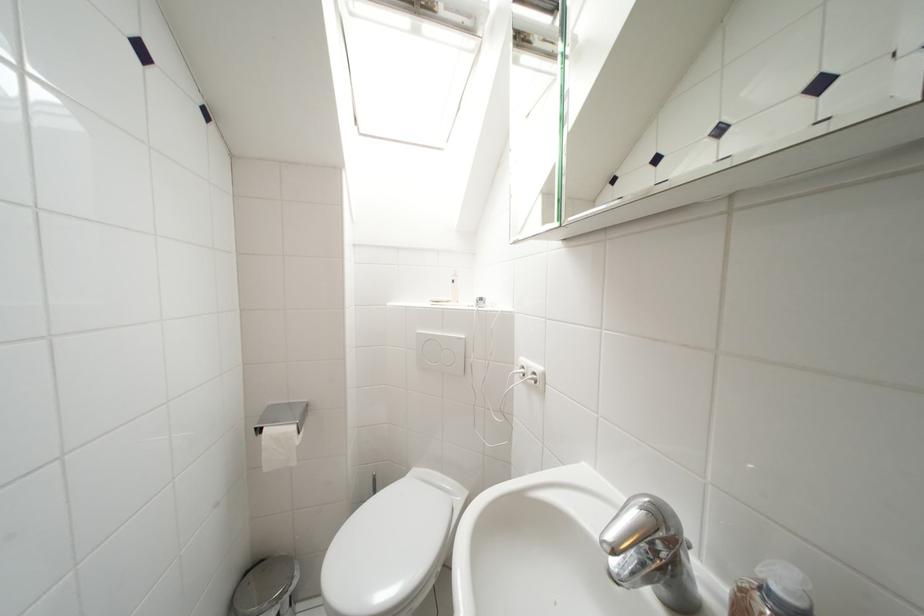
Where would you lift the metal trash can lid? Please return your answer as a coordinate pair (x, y).

(263, 586)